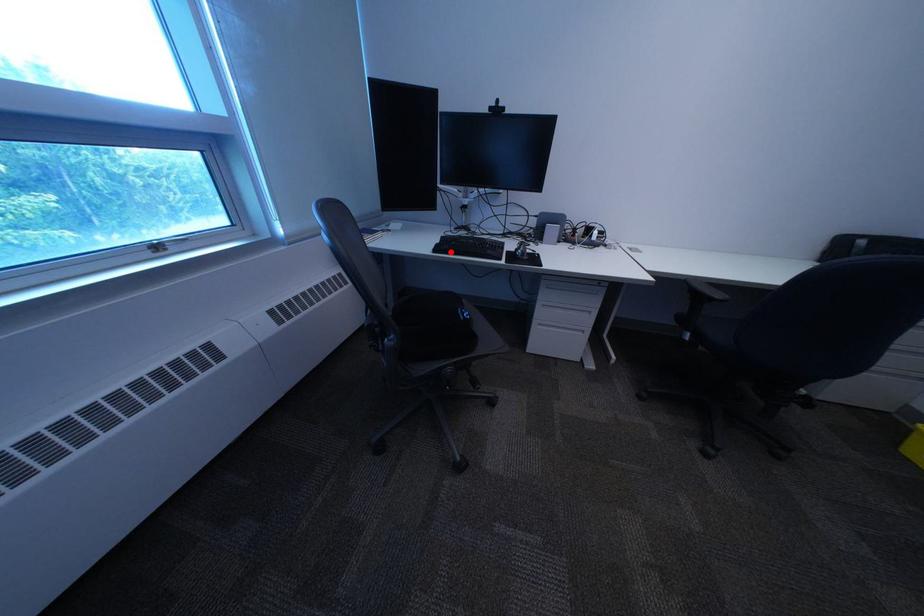
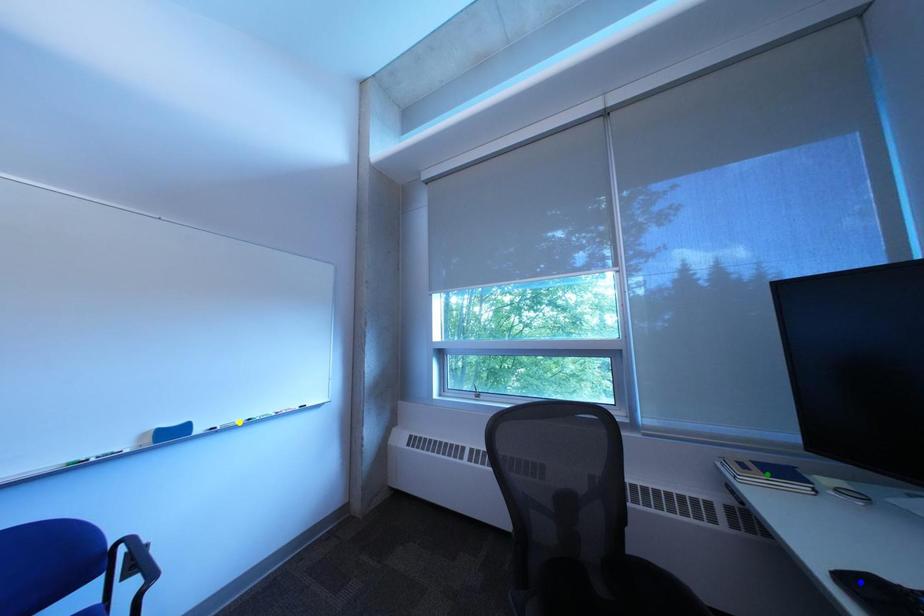
Question: I am providing you with two images of the same scene from different viewpoints. A red point is marked on the first image. You are given multiple points on the second image. Which spot in image 2 lines up with the point in image 1?

Choices:
 (A) blue point
 (B) yellow point
 (C) green point

Answer: (A)